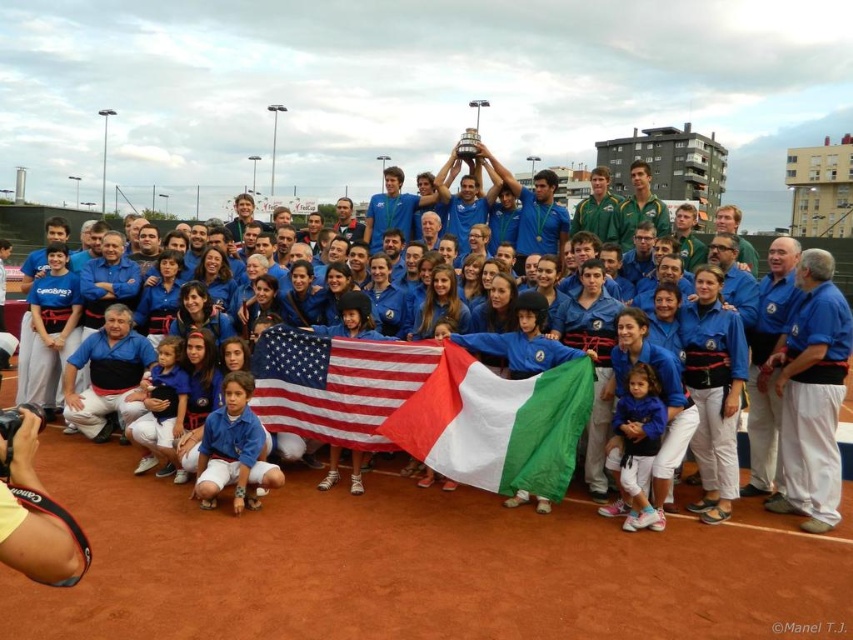
Which is in front, point (10, 310) or point (263, 481)?

Point (263, 481) is more forward.

Between blue fabric flag at center and blue fabric shirt at lower left, which one has more height?

With more height is blue fabric flag at center.

Where is `blue fabric flag at center`? blue fabric flag at center is located at coordinates (33, 221).

This screenshot has width=853, height=640. What are the coordinates of `blue fabric flag at center` in the screenshot? It's located at tap(33, 221).

Is american flag at center further to camera compared to blue fabric shirt at lower left?

Yes, american flag at center is further from the viewer.

Does american flag at center appear on the right side of blue fabric shirt at lower left?

Indeed, american flag at center is positioned on the right side of blue fabric shirt at lower left.

Locate an element on the screen. The height and width of the screenshot is (640, 853). american flag at center is located at coordinates (335, 385).

Which of these two, green matte flag at center or american flag at center, stands taller?

green matte flag at center

Which is more to the left, green matte flag at center or american flag at center?

Positioned to the left is american flag at center.

Does point (405, 445) lie behind point (369, 358)?

No, (405, 445) is in front of (369, 358).

The width and height of the screenshot is (853, 640). Find the location of `green matte flag at center`. green matte flag at center is located at coordinates (496, 422).